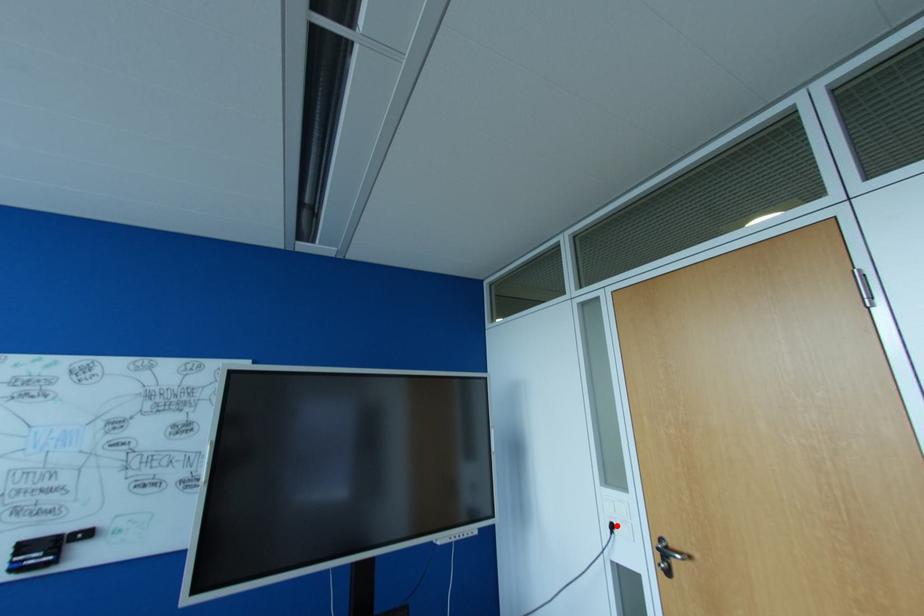
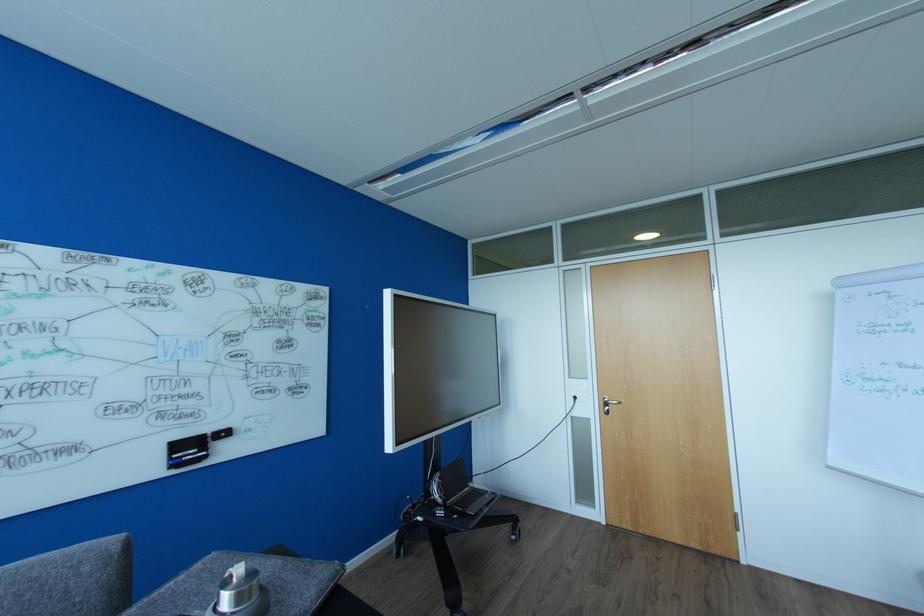
The point at the highlighted location is marked in the first image. Where is the corresponding point in the second image?

(578, 398)